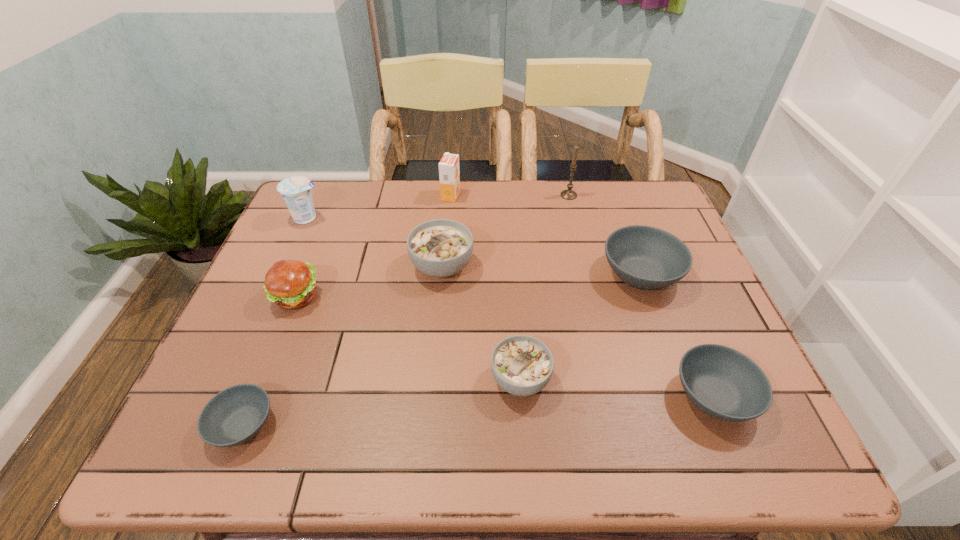
Where is `the nearer white soup bowl`? This screenshot has height=540, width=960. the nearer white soup bowl is located at coordinates (522, 365).

Where is `the third soup bowl from right to left`? The width and height of the screenshot is (960, 540). the third soup bowl from right to left is located at coordinates (522, 365).

Identify the location of the eighth tallest object. The image size is (960, 540). (723, 382).

I want to click on the second shortest soup bowl, so click(723, 382).

At what (x,y) coordinates should I click in order to perform the action: click on the smallest gray soup bowl. Please return your answer as a coordinate pair (x, y). The height and width of the screenshot is (540, 960). Looking at the image, I should click on point(236,414).

Locate an element on the screen. This screenshot has width=960, height=540. the leftmost soup bowl is located at coordinates (236, 414).

This screenshot has height=540, width=960. What are the coordinates of `vacant space positioned 0.090m on the front of the seventh object from left to right` in the screenshot? It's located at (574, 218).

The image size is (960, 540). Identify the location of free space located 0.250m on the front of the eighth shortest object. (445, 257).

Find the location of a particular element. The height and width of the screenshot is (540, 960). free region located on the front of the seventh nearest object is located at coordinates (267, 308).

You are a GUI agent. You are given a task and a screenshot of the screen. Output one action in this format:
    pyautogui.click(x=<x>, y=<y>)
    Task: Click on the vacant region located on the front of the farther white soup bowl
    
    Given the screenshot: What is the action you would take?
    pyautogui.click(x=436, y=341)